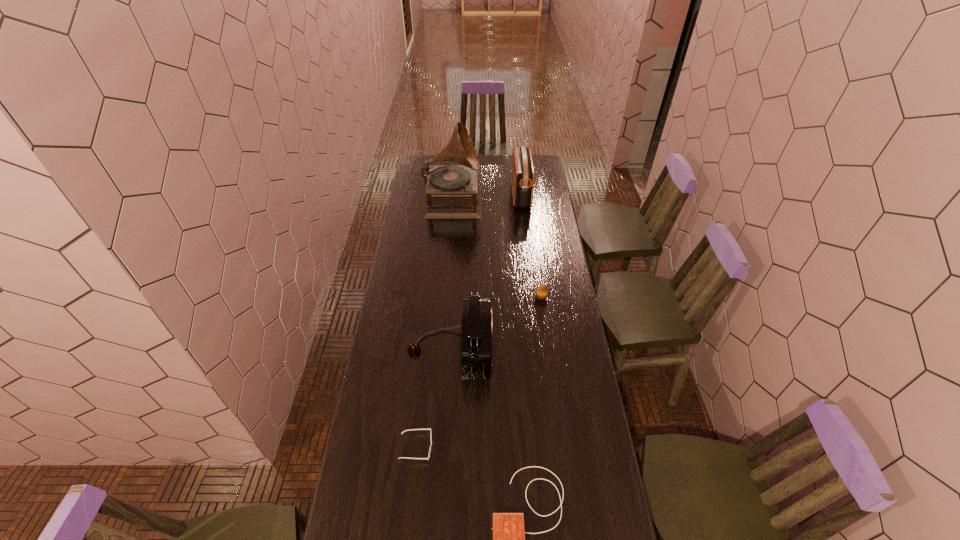
In the image, there is a desktop. Where is `vacant space at the right edge`? Image resolution: width=960 pixels, height=540 pixels. vacant space at the right edge is located at coordinates (596, 435).

Locate an element on the screen. free space between the tallest object and the pear is located at coordinates (497, 248).

The width and height of the screenshot is (960, 540). Find the location of `free space between the pear and the second nearest radio receiver`. free space between the pear and the second nearest radio receiver is located at coordinates (496, 323).

Where is `free spot between the pear and the second farthest radio receiver`? Image resolution: width=960 pixels, height=540 pixels. free spot between the pear and the second farthest radio receiver is located at coordinates (496, 323).

Locate an element on the screen. vacant region between the farthest radio receiver and the third nearest object is located at coordinates (486, 272).

Image resolution: width=960 pixels, height=540 pixels. I want to click on free space between the farthest radio receiver and the tallest object, so click(487, 197).

You are a GUI agent. You are given a task and a screenshot of the screen. Output one action in this format:
    pyautogui.click(x=<x>, y=<y>)
    Task: Click on the free spot between the pear and the fourth farthest object
    
    Given the screenshot: What is the action you would take?
    pyautogui.click(x=496, y=323)

Image resolution: width=960 pixels, height=540 pixels. Identify the location of unoccupied area between the sunglasses and the second farthest radio receiver. (433, 398).

You are a GUI agent. You are given a task and a screenshot of the screen. Output one action in this format:
    pyautogui.click(x=<x>, y=<y>)
    Task: Click on the object identified as the fifth closest to the nearest radio receiver
    
    Given the screenshot: What is the action you would take?
    pyautogui.click(x=522, y=174)

The image size is (960, 540). In order to click on object that stands as the closest to the farthest radio receiver in this screenshot , I will do `click(453, 192)`.